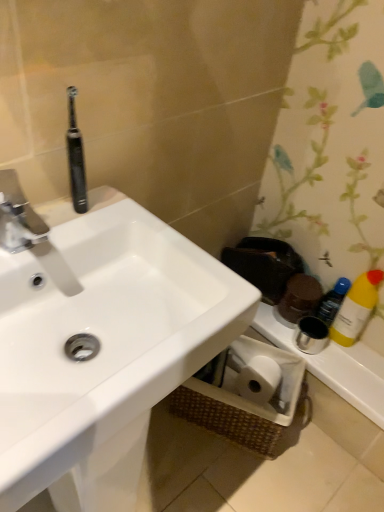
This screenshot has height=512, width=384. I want to click on free space between black rubber toothbrush at upper left and silver metallic faucet at upper left, so click(68, 226).